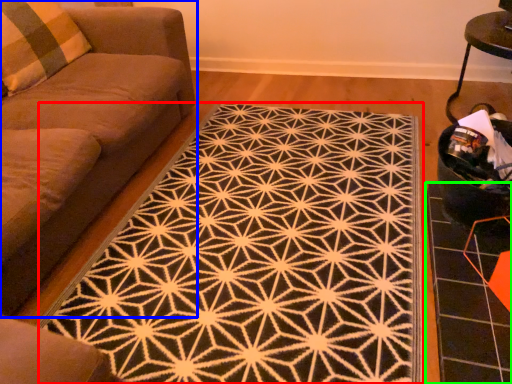
Question: Based on their relative distances, which object is farther from mat (highlighted by a red box)? Choose from studio couch (highlighted by a blue box) and tile (highlighted by a green box).

Choices:
 (A) studio couch
 (B) tile

Answer: (A)